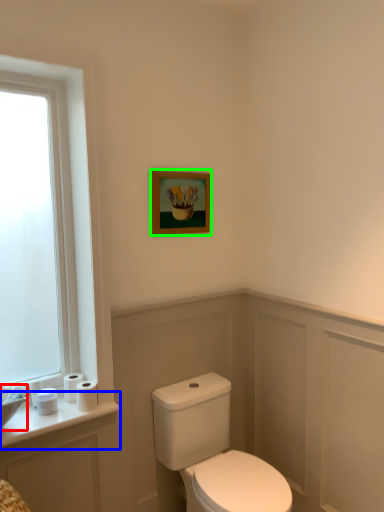
Question: Considering the real-world distances, which object is farthest from sink (highlighted by a red box)? counter top (highlighted by a blue box) or picture frame (highlighted by a green box)?

Choices:
 (A) counter top
 (B) picture frame

Answer: (B)